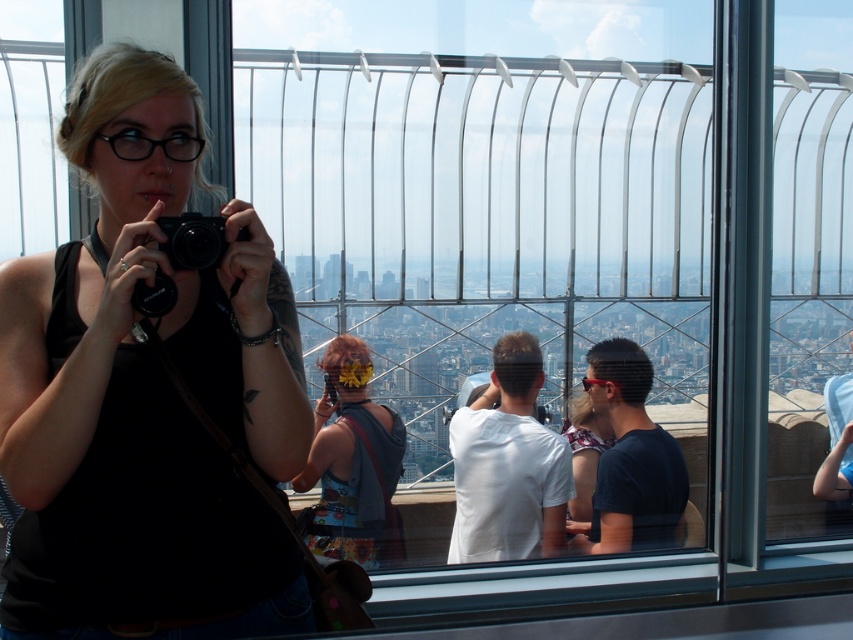
You are a photographer trying to capture a clear shot of the cityscape through the glass railing. You have a white matte shirt at center and a black matte camera at center. Which object should you move to ensure the camera has an unobstructed view of the city?

The black matte camera at center is behind the white matte shirt at center. To ensure an unobstructed view, you should move the white matte shirt at center so the camera can capture the cityscape clearly.

You are standing on the observation deck and want to take a photo of both the city and the woman. The points you need to focus on are point (170, 300) and point (218, 250). Which point should you focus on first to ensure both are in focus?

You should focus on point (170, 300) first because it is closer to the camera than point (218, 250), ensuring both points are within the depth of field.

You are a photographer trying to capture a reflection of the cityscape in the glass railing. You have a white matte shirt at center and a black matte camera at center. Which object should you position closer to the glass railing to ensure the reflection of the cityscape is more prominent in your photo?

The white matte shirt at center is taller than the black matte camera at center. To ensure the reflection of the cityscape is more prominent, position the black matte camera at center closer to the glass railing since it is shorter and less likely to obstruct the reflection.